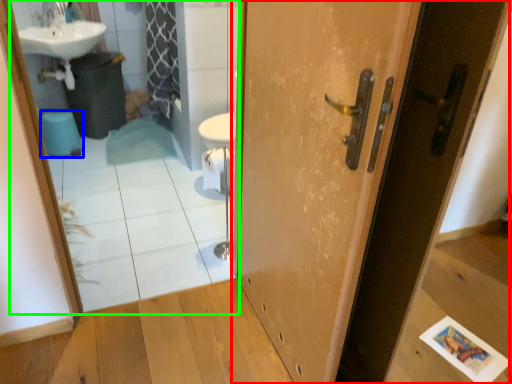
Question: Which object is the farthest from door (highlighted by a red box)? Choose among these: toilet bowl (highlighted by a blue box) or mirror (highlighted by a green box).

Choices:
 (A) toilet bowl
 (B) mirror

Answer: (A)